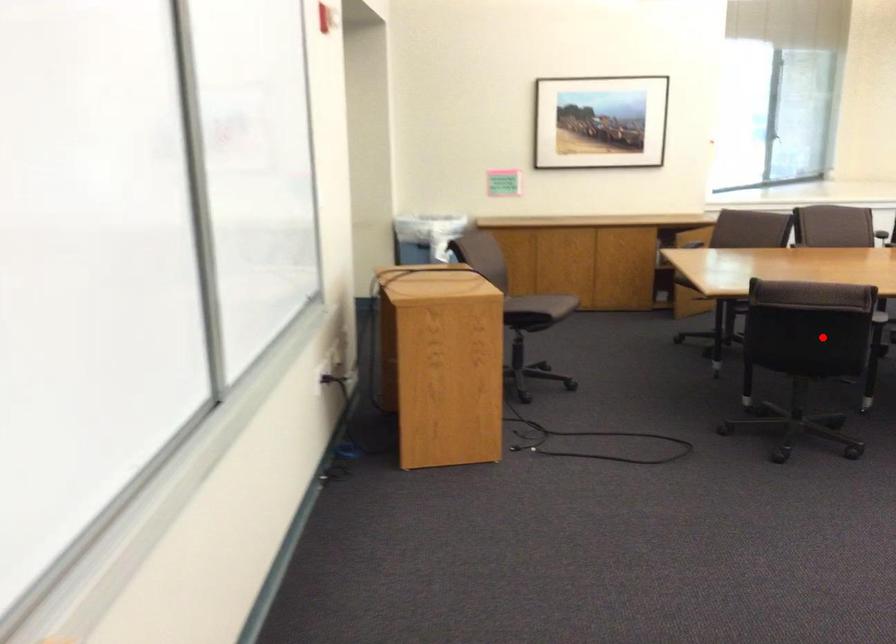
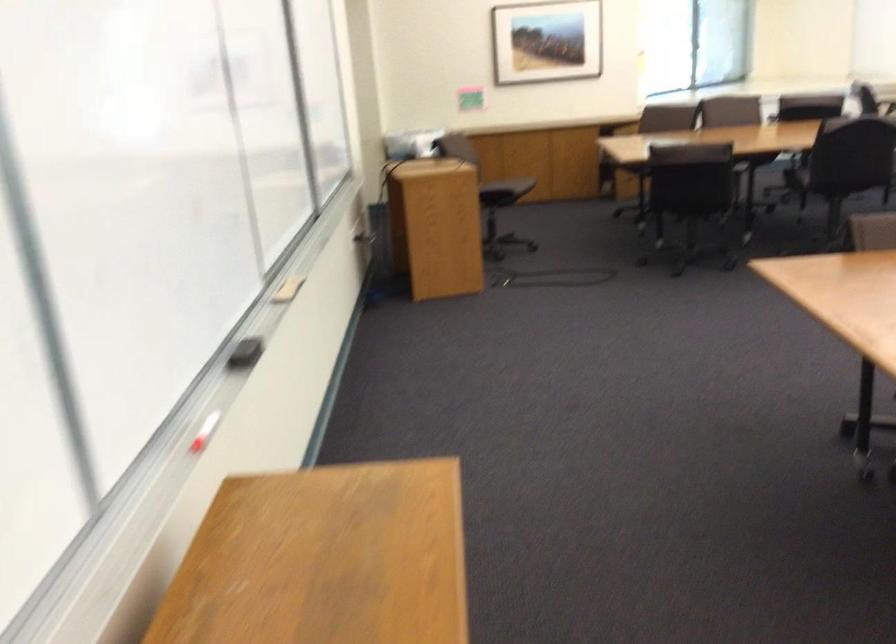
In the second image, find the point that corresponds to the highlighted location in the first image.

(700, 176)